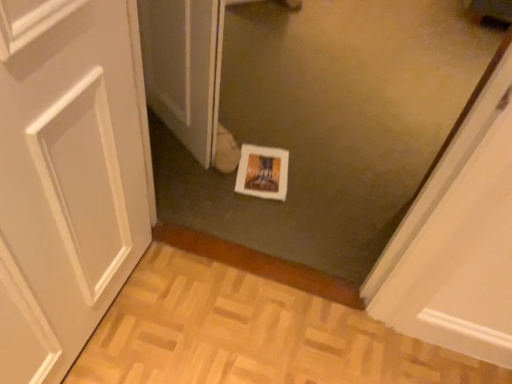
Question: Considering the positions of white glossy screen door at center and white glossy print at center in the image, is white glossy screen door at center wider or thinner than white glossy print at center?

Choices:
 (A) wide
 (B) thin

Answer: (B)

Question: Looking at the image, does white glossy screen door at center seem bigger or smaller compared to white glossy print at center?

Choices:
 (A) big
 (B) small

Answer: (A)

Question: From the image's perspective, is white glossy screen door at center above or below white glossy print at center?

Choices:
 (A) above
 (B) below

Answer: (A)

Question: Do you think white glossy print at center is within white glossy screen door at center, or outside of it?

Choices:
 (A) inside
 (B) outside

Answer: (B)

Question: Visually, is white glossy print at center positioned to the left or to the right of white glossy screen door at center?

Choices:
 (A) right
 (B) left

Answer: (A)

Question: From a real-world perspective, relative to white glossy screen door at center, is white glossy print at center vertically above or below?

Choices:
 (A) above
 (B) below

Answer: (B)

Question: Considering the positions of white glossy print at center and white glossy screen door at center in the image, is white glossy print at center taller or shorter than white glossy screen door at center?

Choices:
 (A) short
 (B) tall

Answer: (A)